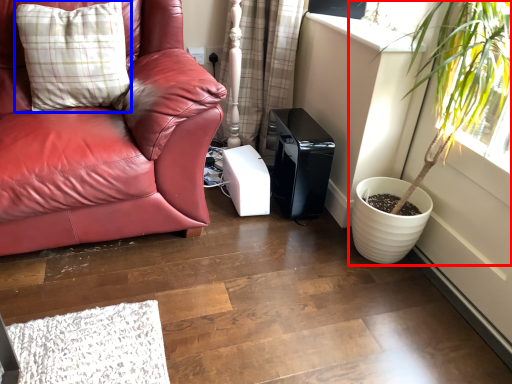
Question: Among these objects, which one is farthest to the camera, houseplant (highlighted by a red box) or pillow (highlighted by a blue box)?

Choices:
 (A) houseplant
 (B) pillow

Answer: (B)